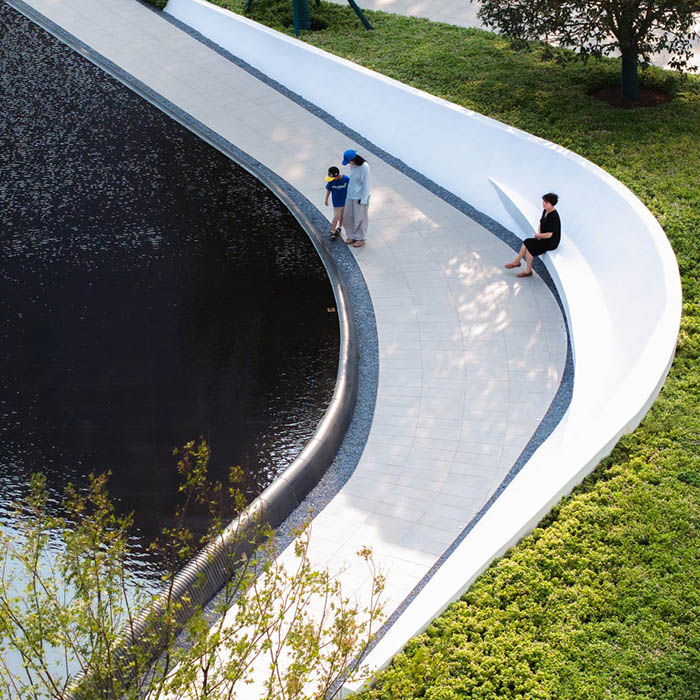
Identify the location of walls. (342, 371), (512, 134).